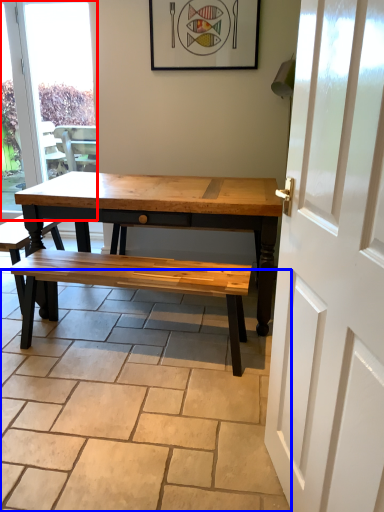
Question: Which of the following is the closest to the observer, window (highlighted by a red box) or path (highlighted by a blue box)?

Choices:
 (A) window
 (B) path

Answer: (B)